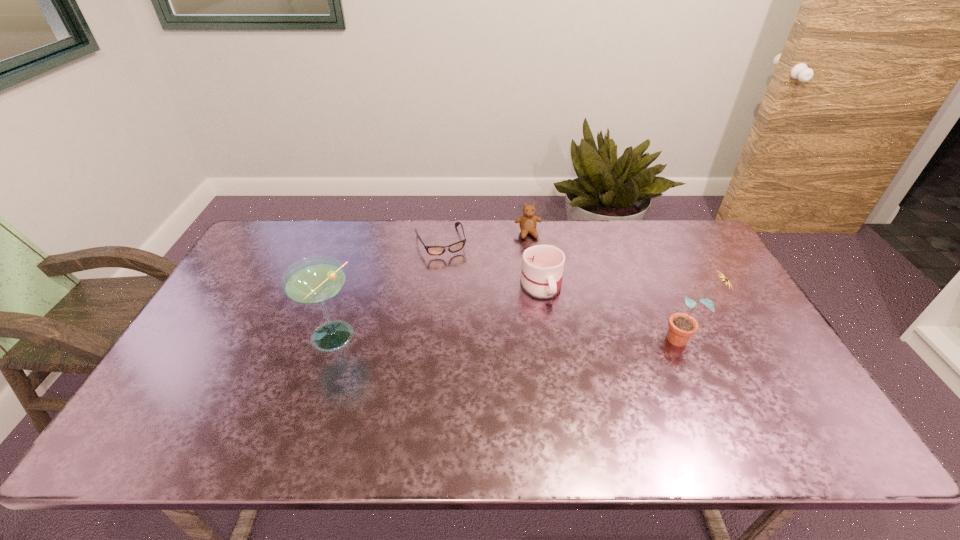
Locate an element on the screen. This screenshot has height=540, width=960. spectacles present at the far edge is located at coordinates click(x=455, y=247).

You are a GUI agent. You are given a task and a screenshot of the screen. Output one action in this format:
    pyautogui.click(x=<x>, y=<y>)
    Task: Click on the vacant space at the far edge of the desktop
    
    Given the screenshot: What is the action you would take?
    pyautogui.click(x=635, y=240)

Locate an element on the screen. free spot at the near edge of the desktop is located at coordinates (582, 407).

Where is `free space at the left edge of the desktop`? free space at the left edge of the desktop is located at coordinates (274, 293).

Locate an element on the screen. vacant space at the right edge of the desktop is located at coordinates (732, 367).

In the image, there is a desktop. Identify the location of vacant region at the far right corner. (680, 226).

Locate an element on the screen. Image resolution: width=960 pixels, height=540 pixels. empty location between the leftmost object and the mug is located at coordinates (436, 312).

This screenshot has height=540, width=960. I want to click on free area in between the martini and the shortest object, so click(386, 290).

Find the location of a particular element. free space between the sunflower and the mug is located at coordinates (613, 312).

Identify the location of vacant space that is in between the second object from left to right and the third nearest object. (491, 264).